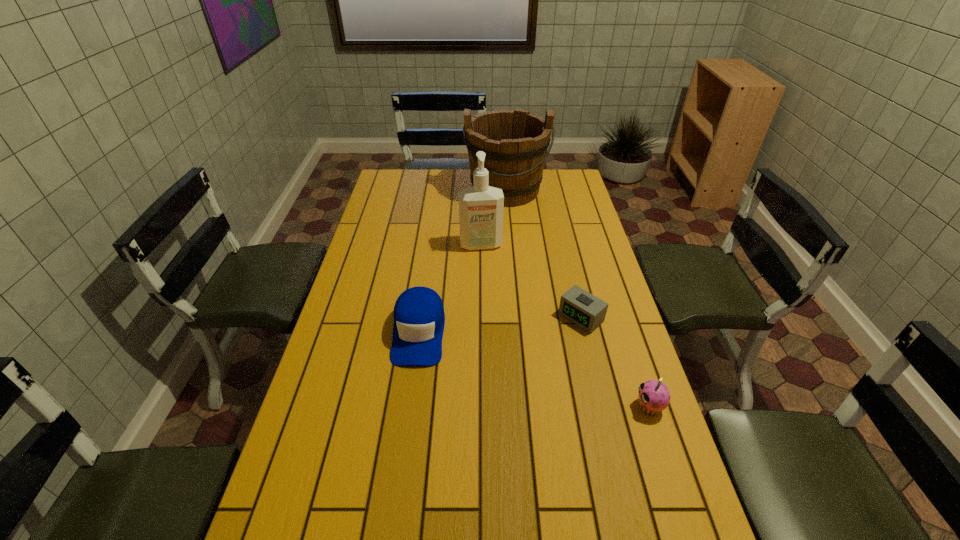
This screenshot has width=960, height=540. What are the coordinates of `unoccupied area between the alarm clock and the baseball cap` in the screenshot? It's located at (500, 325).

Where is `vacant space in between the alarm clock and the second farthest object`? vacant space in between the alarm clock and the second farthest object is located at coordinates (531, 281).

Identify the location of vacant area between the baseball cap and the shortest object. The image size is (960, 540). (500, 325).

Locate an element on the screen. The width and height of the screenshot is (960, 540). unoccupied area between the alarm clock and the cleansing agent is located at coordinates (531, 281).

Where is `free area in between the farthest object and the leftmost object`? free area in between the farthest object and the leftmost object is located at coordinates (463, 261).

Locate an element on the screen. Image resolution: width=960 pixels, height=540 pixels. vacant region between the alarm clock and the farthest object is located at coordinates (543, 254).

You are a GUI agent. You are given a task and a screenshot of the screen. Output one action in this format:
    pyautogui.click(x=<x>, y=<y>)
    Task: Click on the free space between the shortest object and the fourth nearest object
    This screenshot has height=540, width=960.
    Given the screenshot: What is the action you would take?
    pyautogui.click(x=531, y=281)

The height and width of the screenshot is (540, 960). I want to click on free space between the shortest object and the leftmost object, so click(x=500, y=325).

Choose which object is the nearest neighbor to the alarm clock. Please provide its 2D coordinates. Your answer should be formatted as a tuple, i.e. [(x, y)], where the tuple contains the x and y coordinates of a point satisfying the conditions above.

[(654, 396)]

Locate an element on the screen. Image resolution: width=960 pixels, height=540 pixels. object identified as the third closest to the cleansing agent is located at coordinates (582, 308).